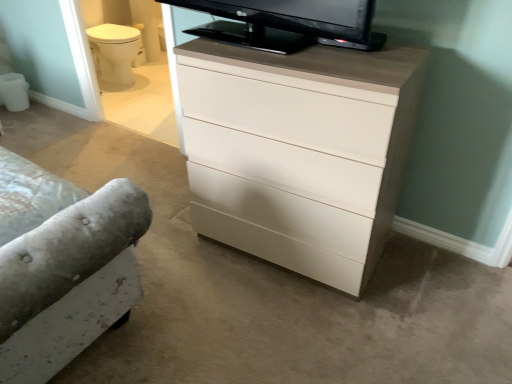
Question: Is point click(x=274, y=192) closer or farther from the camera than point click(x=373, y=259)?

Choices:
 (A) farther
 (B) closer

Answer: (B)

Question: Is white matte drawer at center to the left or to the right of white glossy chest of drawers at center in the image?

Choices:
 (A) right
 (B) left

Answer: (A)

Question: From a real-world perspective, relative to white glossy chest of drawers at center, is white matte drawer at center vertically above or below?

Choices:
 (A) below
 (B) above

Answer: (A)

Question: From the image's perspective, relative to white matte drawer at center, is white glossy chest of drawers at center above or below?

Choices:
 (A) above
 (B) below

Answer: (A)

Question: Is white glossy chest of drawers at center wider or thinner than white matte drawer at center?

Choices:
 (A) wide
 (B) thin

Answer: (A)

Question: Is white glossy chest of drawers at center in front of or behind white matte drawer at center in the image?

Choices:
 (A) behind
 (B) front

Answer: (B)

Question: Is point (317, 150) positioned closer to the camera than point (307, 208)?

Choices:
 (A) closer
 (B) farther

Answer: (A)